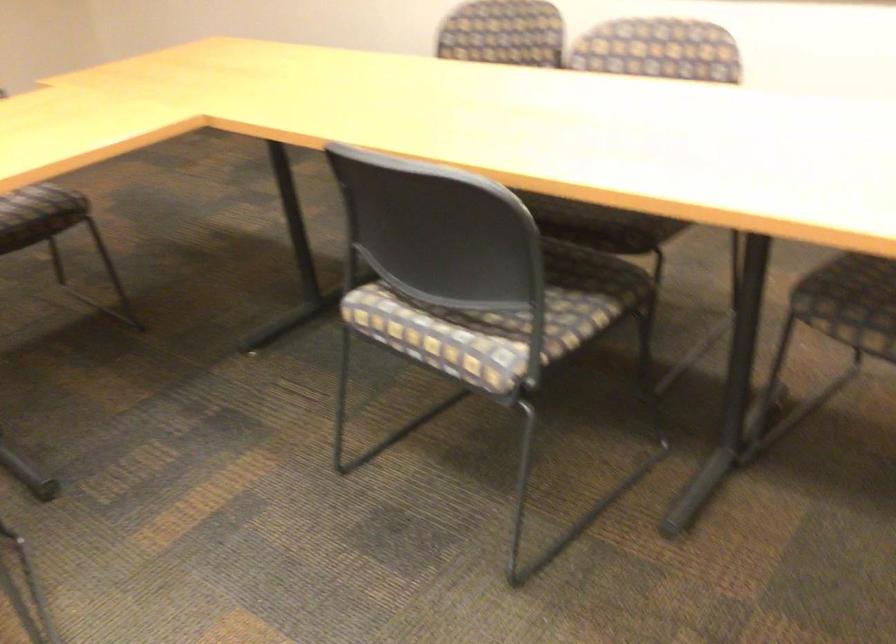
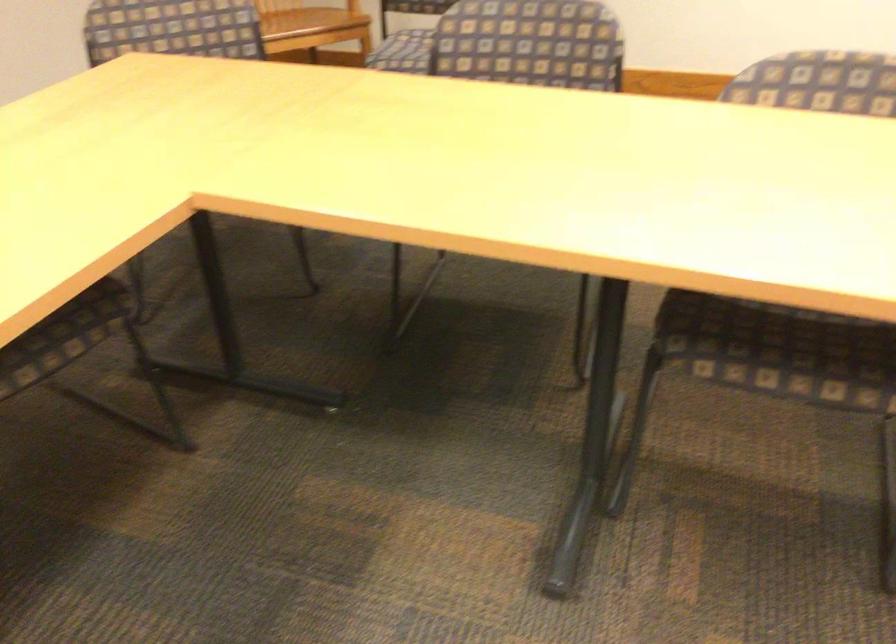
First-person continuous shooting, in which direction is the camera rotating?

The camera's rotation is toward right-down.